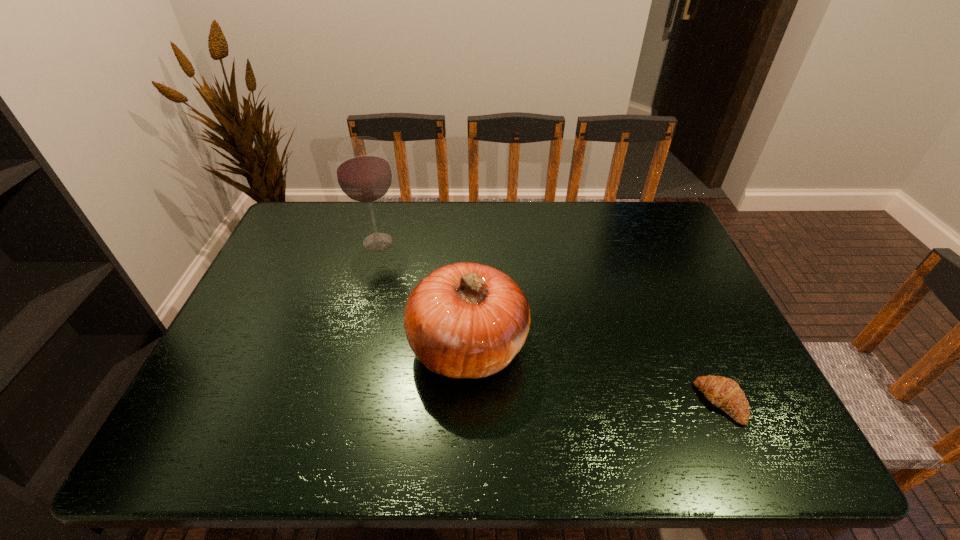
Where is `the farthest object`? This screenshot has height=540, width=960. the farthest object is located at coordinates (364, 175).

Find the location of a particular element. the leftmost object is located at coordinates (364, 175).

The image size is (960, 540). What are the coordinates of `the second object from left to right` in the screenshot? It's located at (464, 320).

Image resolution: width=960 pixels, height=540 pixels. What are the coordinates of `pumpkin` in the screenshot? It's located at (464, 320).

I want to click on the rightmost object, so click(x=724, y=393).

Identify the location of crescent roll. The image size is (960, 540). pos(724,393).

This screenshot has height=540, width=960. I want to click on free space located 0.250m on the front of the farthest object, so click(357, 320).

Image resolution: width=960 pixels, height=540 pixels. Identify the location of vacant space located 0.140m on the right of the pumpkin. (584, 346).

Identify the location of vacant space situated on the left of the crescent roll. The height and width of the screenshot is (540, 960). (641, 402).

Find the location of `object that is at the far edge`. object that is at the far edge is located at coordinates (364, 175).